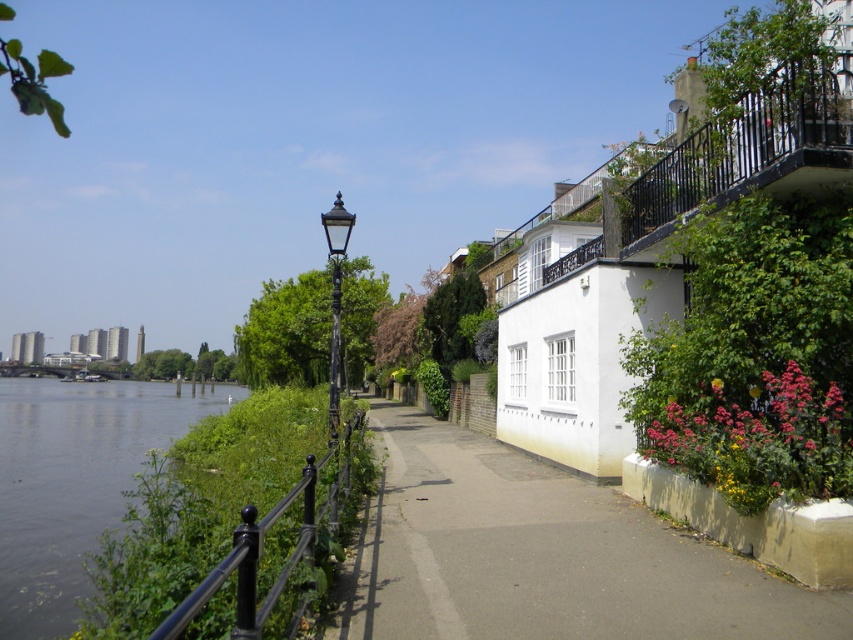
Is vivid pink petals at lower right further to camera compared to black polished metal streetlight at center?

That is False.

Who is lower down, vivid pink petals at lower right or black polished metal streetlight at center?

vivid pink petals at lower right

Which is behind, point (714, 460) or point (337, 381)?

Positioned behind is point (337, 381).

The image size is (853, 640). I want to click on vivid pink petals at lower right, so click(x=761, y=444).

At what (x,y) coordinates should I click in order to perform the action: click on green grassy river at left. Please return your answer as a coordinate pair (x, y). The height and width of the screenshot is (640, 853). Looking at the image, I should click on (73, 483).

Measure the distance between green grassy river at left and camera.

green grassy river at left is 8.91 meters away from camera.

Is point (12, 604) behind point (732, 420)?

Yes.

What are the coordinates of `green grassy river at left` in the screenshot? It's located at (73, 483).

Looking at this image, between smooth concrete pavement at center and black polished metal streetlight at center, which one appears on the right side from the viewer's perspective?

Positioned to the right is smooth concrete pavement at center.

Which is behind, point (482, 483) or point (338, 385)?

Positioned behind is point (338, 385).

Is point (361, 614) in front of point (344, 220)?

Yes, point (361, 614) is closer to viewer.

The width and height of the screenshot is (853, 640). I want to click on smooth concrete pavement at center, so click(546, 556).